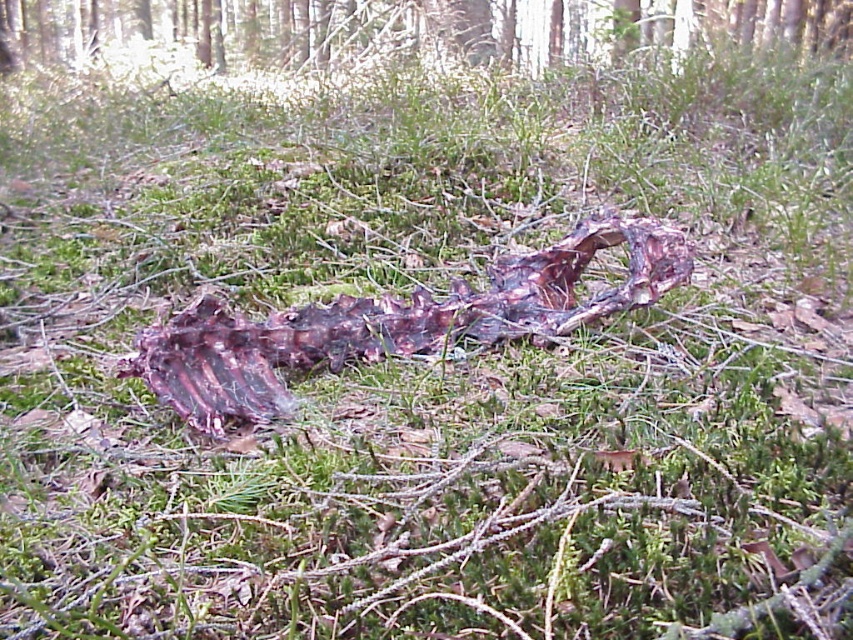
Question: Does smooth bark tree at upper center appear over rusty metallic ribcage at center?

Choices:
 (A) no
 (B) yes

Answer: (B)

Question: Can you confirm if smooth bark tree at upper center is positioned above rusty metallic ribcage at center?

Choices:
 (A) yes
 (B) no

Answer: (A)

Question: Is smooth bark tree at upper center positioned in front of rusty metallic ribcage at center?

Choices:
 (A) no
 (B) yes

Answer: (A)

Question: Among these points, which one is nearest to the camera?

Choices:
 (A) (195, 404)
 (B) (482, 32)

Answer: (A)